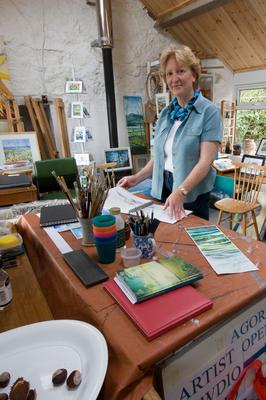
At what (x,y) coordinates should I click in order to perform the action: click on ceiling. Please return your answer as a coordinate pair (x, y). Looking at the image, I should click on (229, 29).